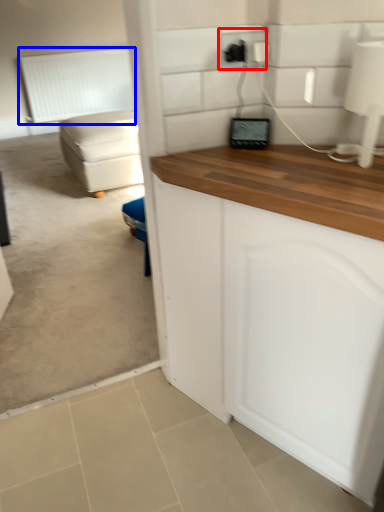
Question: Which point is further to the camera, electric outlet (highlighted by a red box) or radiator (highlighted by a blue box)?

Choices:
 (A) electric outlet
 (B) radiator

Answer: (B)